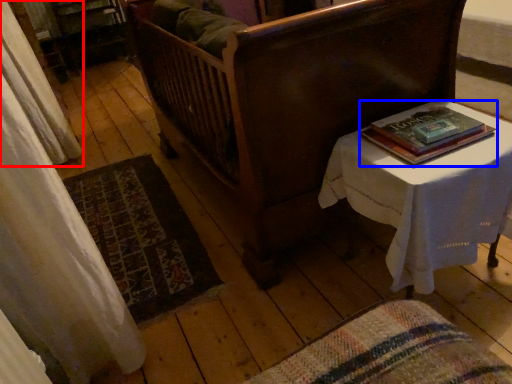
Question: Which object is closer to the camera taking this photo, curtain (highlighted by a red box) or book (highlighted by a blue box)?

Choices:
 (A) curtain
 (B) book

Answer: (B)